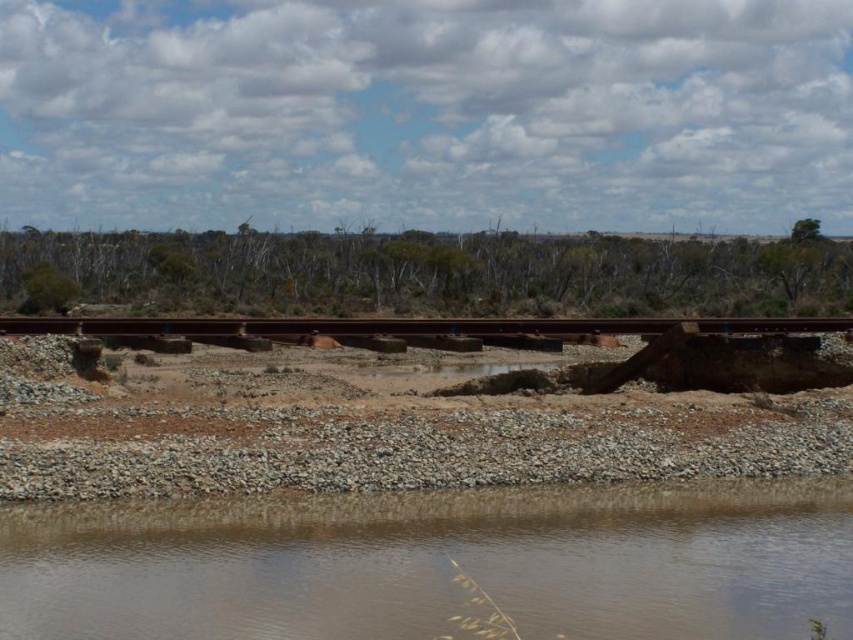
Question: Is brown sedimentary water at lower center wider than green leafy tree at upper right?

Choices:
 (A) yes
 (B) no

Answer: (B)

Question: Which of the following is the closest to the observer?

Choices:
 (A) (816, 230)
 (B) (42, 250)

Answer: (B)

Question: Is brown sedimentary water at lower center in front of green leafy trees at center?

Choices:
 (A) no
 (B) yes

Answer: (B)

Question: Among these points, which one is nearest to the camera?

Choices:
 (A) (120, 317)
 (B) (796, 225)
 (C) (260, 278)

Answer: (A)

Question: Which is nearer to the green leafy tree at upper right?

Choices:
 (A) brown sedimentary water at lower center
 (B) brown concrete train track at center
 (C) green leafy trees at center

Answer: (C)

Question: Is brown sedimentary water at lower center positioned behind brown concrete train track at center?

Choices:
 (A) no
 (B) yes

Answer: (A)